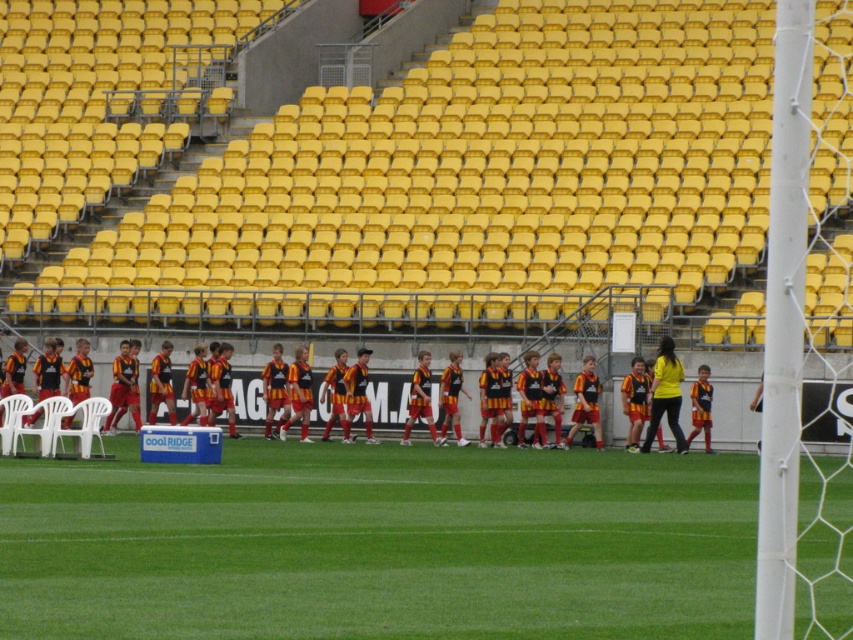
In the scene shown: Does green grass at center come behind black jersey at center?

No.

Which is above, green grass at center or black jersey at center?

black jersey at center

Locate an element on the screen. The width and height of the screenshot is (853, 640). green grass at center is located at coordinates (378, 544).

Where is `green grass at center`? The width and height of the screenshot is (853, 640). green grass at center is located at coordinates (378, 544).